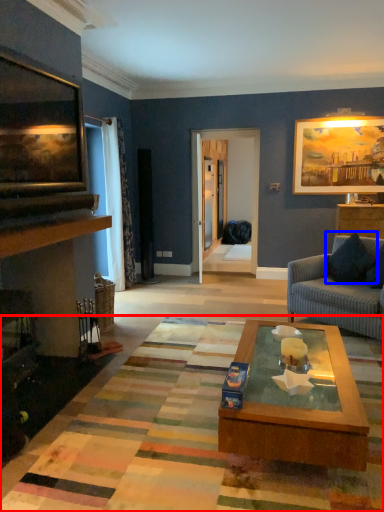
Question: Which object appears farthest to the camera in this image, mat (highlighted by a red box) or pillow (highlighted by a blue box)?

Choices:
 (A) mat
 (B) pillow

Answer: (B)